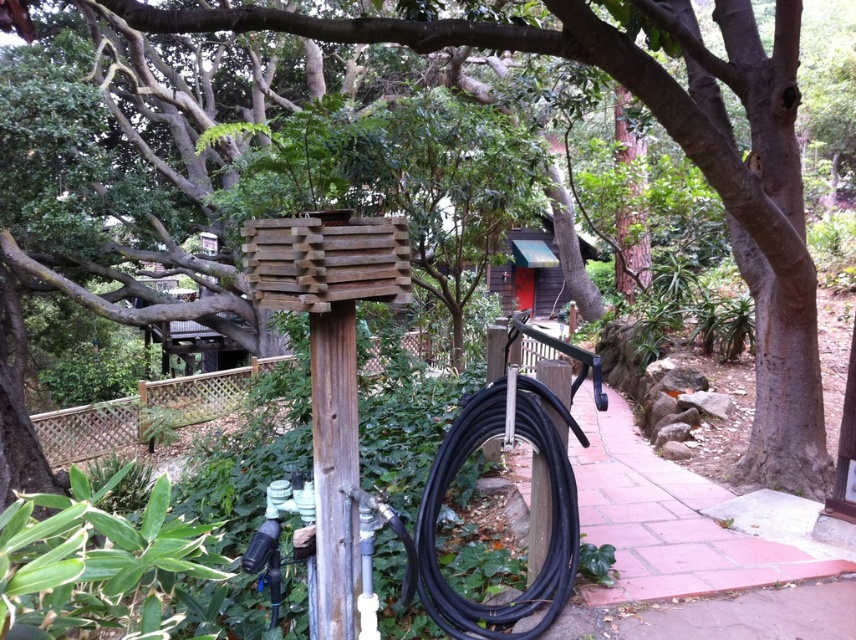
Question: Is the position of black rubber hose at center less distant than that of brown rough wood pole at center?

Choices:
 (A) no
 (B) yes

Answer: (A)

Question: Based on their relative distances, which object is nearer to the wooden hut at upper center?

Choices:
 (A) black rubber hose at center
 (B) brown rough wood pole at center

Answer: (A)

Question: Which of the following is the closest to the observer?

Choices:
 (A) black rubber hose at center
 (B) brown rough wood pole at center

Answer: (B)

Question: Considering the relative positions of black rubber hose at center and wooden hut at upper center in the image provided, where is black rubber hose at center located with respect to wooden hut at upper center?

Choices:
 (A) right
 (B) left

Answer: (B)

Question: Which object appears farthest from the camera in this image?

Choices:
 (A) wooden hut at upper center
 (B) black rubber hose at center
 (C) brown rough wood pole at center

Answer: (A)

Question: Is black rubber hose at center positioned before wooden hut at upper center?

Choices:
 (A) no
 (B) yes

Answer: (B)